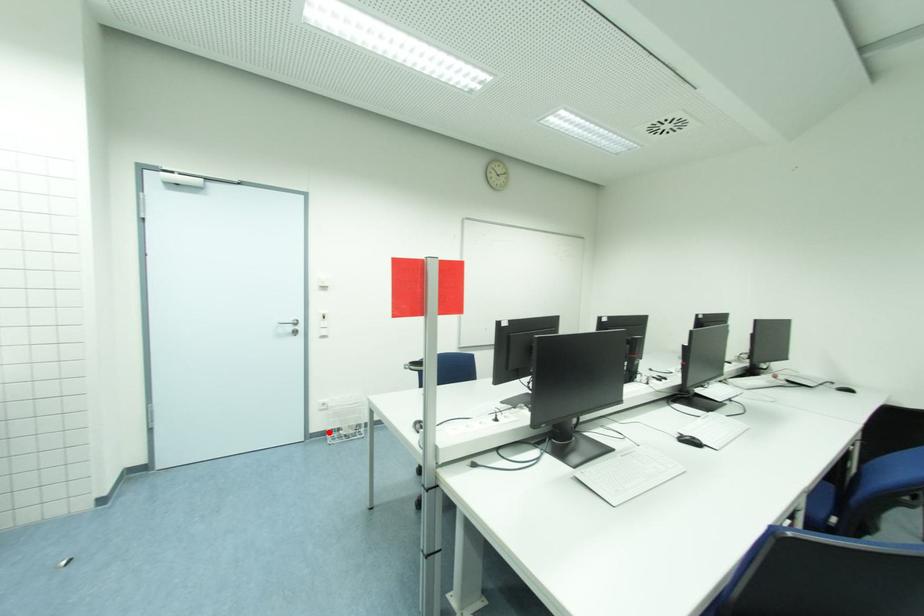
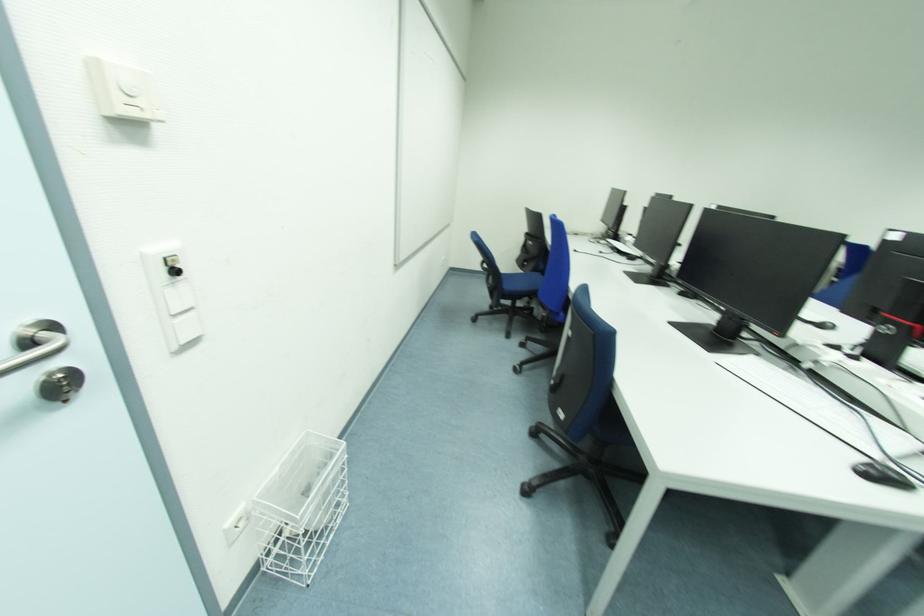
Question: I am providing you with two images of the same scene from different viewpoints. Image1 has a red point marked. In image2, the corresponding 3D location appears at what relative position? Reply with the corresponding letter.

Choices:
 (A) Closer
 (B) Farther

Answer: (A)